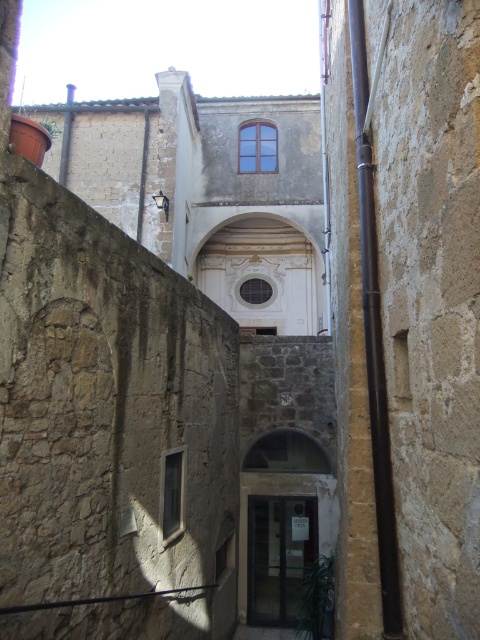
In the scene shown: You are a delivery person trying to enter the alleyway with a large box that is 2 meters tall. The box must fit under any structures in the alley. Based on the scene, will the white marble archway at center and the matte glass door at center allow the box to pass through?

The white marble archway at center is shorter than the matte glass door at center. Since the box is 2 meters tall, it will not fit under the white marble archway at center, but it might fit under the matte glass door at center if its height is at least 2 meters. However, without knowing the exact height of the door, we cannot confirm for certain.

In the scene shown: You are a delivery person trying to enter the alleyway and need to locate the entrance. You see a white marble archway at center and a matte glass door at center. Which object is closer to you, and thus the entrance?

The matte glass door at center is behind the white marble archway at center, so the white marble archway at center is closer to you, making it the entrance.